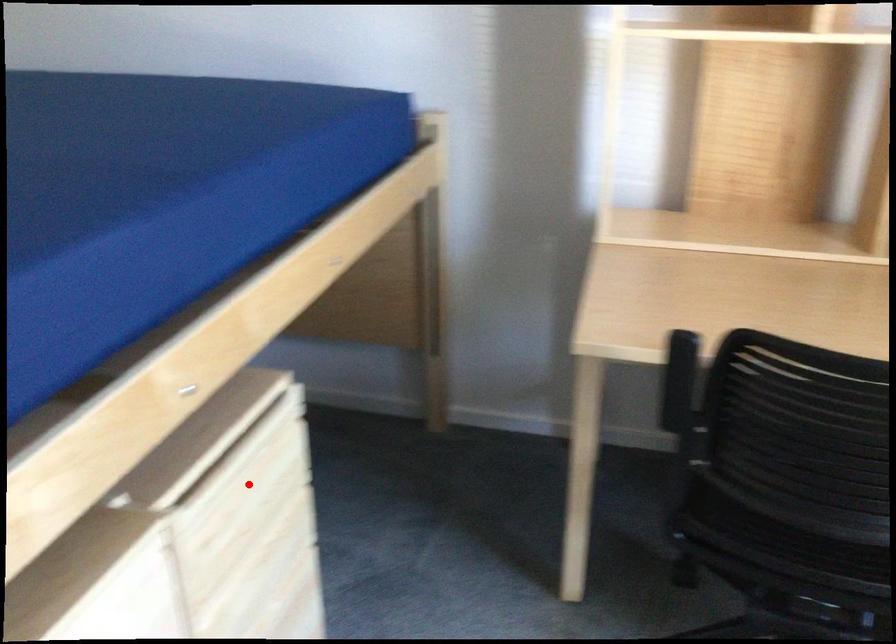
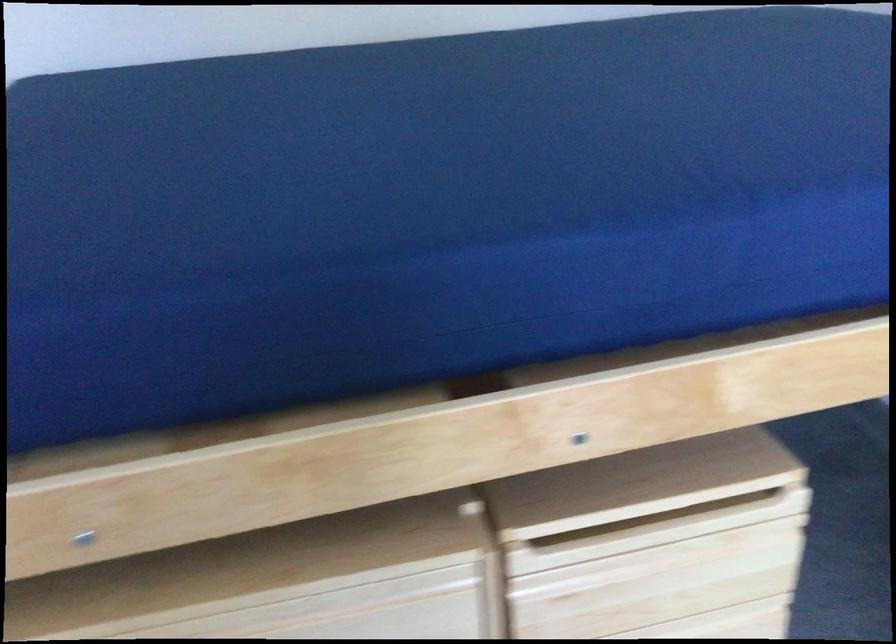
In the second image, find the point that corresponds to the highlighted location in the first image.

(668, 559)